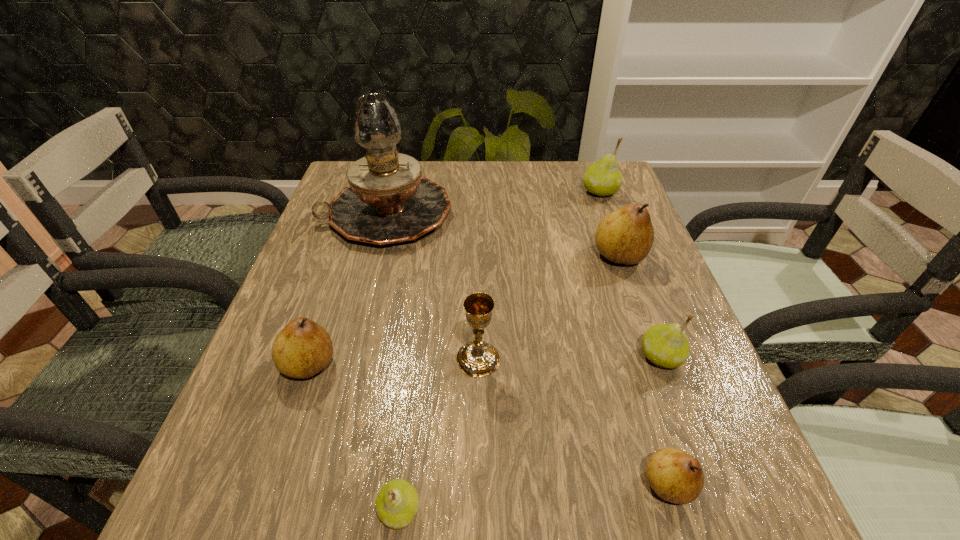
Locate an element on the screen. This screenshot has height=540, width=960. the smallest green pear is located at coordinates (397, 503).

Identify the location of the leftmost green pear. Image resolution: width=960 pixels, height=540 pixels. (397, 503).

Find the location of `vacant point located 0.060m on the back of the tallest object`. vacant point located 0.060m on the back of the tallest object is located at coordinates (397, 171).

Locate an element on the screen. The image size is (960, 540). blank area located 0.150m on the front of the biggest green pear is located at coordinates (616, 236).

This screenshot has width=960, height=540. Identify the location of vacant space situated 0.140m on the left of the second farthest pear. (532, 256).

The width and height of the screenshot is (960, 540). In order to click on free spot located on the left of the chalice in this screenshot , I will do `click(325, 359)`.

You are a GUI agent. You are given a task and a screenshot of the screen. Output one action in this format:
    pyautogui.click(x=<x>, y=<y>)
    Task: Click on the free space located on the back of the leftmost brown pear
    This screenshot has width=960, height=540.
    Given the screenshot: What is the action you would take?
    pyautogui.click(x=353, y=236)

Locate an element on the screen. The height and width of the screenshot is (540, 960). vacant space located on the left of the second farthest green pear is located at coordinates (514, 357).

Where is `free space located on the back of the nearest brown pear`? The height and width of the screenshot is (540, 960). free space located on the back of the nearest brown pear is located at coordinates (619, 325).

I want to click on free space located on the left of the leftmost green pear, so click(206, 510).